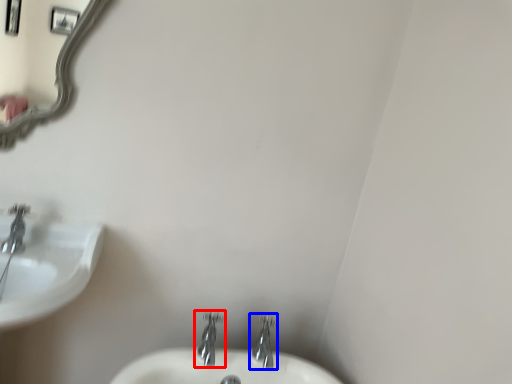
Question: Which object appears closest to the camera in this image, tap (highlighted by a red box) or tap (highlighted by a blue box)?

Choices:
 (A) tap
 (B) tap

Answer: (A)